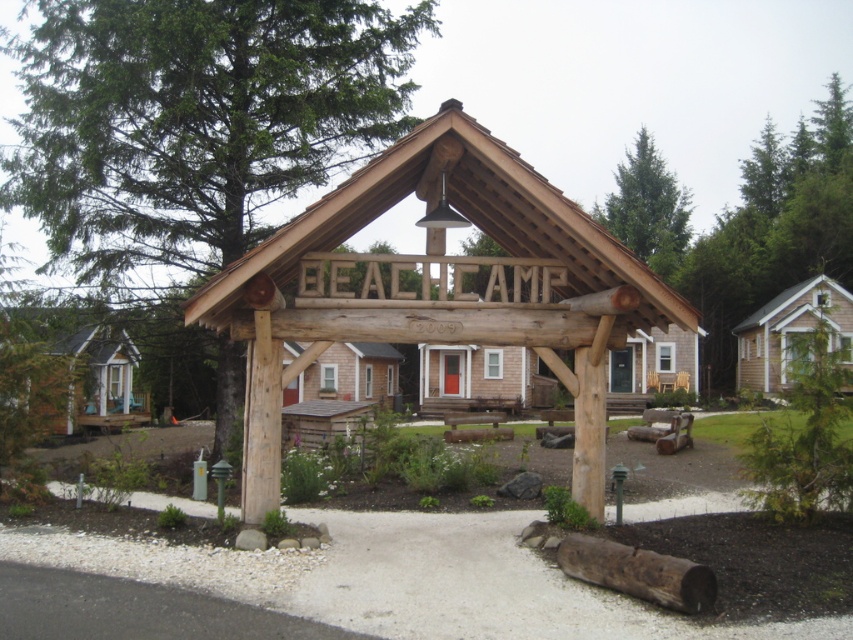
The height and width of the screenshot is (640, 853). Identify the location of wooden cabin at left. (80, 384).

Does wooden cabin at left have a smaller size compared to green coniferous tree at upper right?

Indeed, wooden cabin at left has a smaller size compared to green coniferous tree at upper right.

Does point (91, 352) come in front of point (628, 198)?

Yes, point (91, 352) is in front of point (628, 198).

This screenshot has height=640, width=853. Identify the location of wooden cabin at left. (80, 384).

Is wooden cabin at right in front of wooden cabin at center?

No, wooden cabin at right is behind wooden cabin at center.

Is point (770, 333) in front of point (368, 388)?

Yes, point (770, 333) is closer to viewer.

The width and height of the screenshot is (853, 640). Describe the element at coordinates (790, 332) in the screenshot. I see `wooden cabin at right` at that location.

At what (x,y) coordinates should I click in order to perform the action: click on wooden cabin at right. Please return your answer as a coordinate pair (x, y). The height and width of the screenshot is (640, 853). Looking at the image, I should click on (790, 332).

Can you confirm if natural wood sign at center is thinner than wooden cabin at left?

Yes.

Is natural wood sign at center below wooden cabin at left?

No, natural wood sign at center is not below wooden cabin at left.

Where is `natural wood sign at center`? The image size is (853, 640). natural wood sign at center is located at coordinates (461, 212).